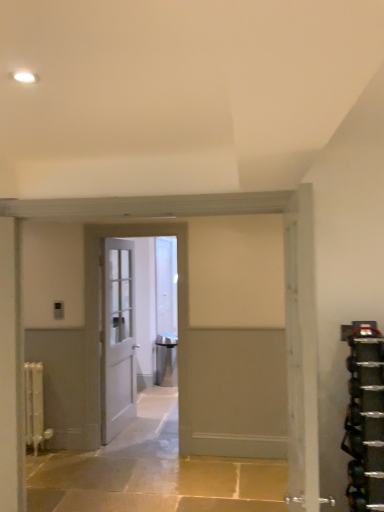
Question: From the image's perspective, would you say white matte radiator at left is shown under white painted wood door at center, acting as the 4th door starting from the left?

Choices:
 (A) no
 (B) yes

Answer: (B)

Question: Can you confirm if white matte radiator at left is wider than white painted wood door at center, acting as the fourth door starting from the back?

Choices:
 (A) no
 (B) yes

Answer: (A)

Question: Can you confirm if white matte radiator at left is positioned to the left of white painted wood door at center, acting as the fourth door starting from the back?

Choices:
 (A) no
 (B) yes

Answer: (B)

Question: Is the surface of white matte radiator at left in direct contact with white painted wood door at center, acting as the 4th door starting from the left?

Choices:
 (A) yes
 (B) no

Answer: (B)

Question: Is white painted wood door at center, which is the first door from right to left, located within white matte radiator at left?

Choices:
 (A) yes
 (B) no

Answer: (B)

Question: In the image, is white matte radiator at left on the left side or the right side of white painted wood door at center, acting as the 4th door starting from the left?

Choices:
 (A) right
 (B) left

Answer: (B)

Question: Considering the positions of white matte radiator at left and white painted wood door at center, acting as the 4th door starting from the left, in the image, is white matte radiator at left bigger or smaller than white painted wood door at center, acting as the 4th door starting from the left,?

Choices:
 (A) small
 (B) big

Answer: (A)

Question: From the image's perspective, relative to white painted wood door at center, acting as the fourth door starting from the back, is white matte radiator at left above or below?

Choices:
 (A) below
 (B) above

Answer: (A)

Question: Looking at their shapes, would you say white matte radiator at left is wider or thinner than white painted wood door at center, the first door viewed from the front?

Choices:
 (A) wide
 (B) thin

Answer: (B)

Question: In the image, is white wooden door at center, acting as the 3th door starting from the front, on the left side or the right side of white wooden door at center, acting as the second door starting from the left?

Choices:
 (A) right
 (B) left

Answer: (B)

Question: From the image's perspective, is white wooden door at center, the 2th door when ordered from back to front, positioned above or below white wooden door at center, which appears as the second door when viewed from the front?

Choices:
 (A) below
 (B) above

Answer: (A)

Question: Is white wooden door at center, acting as the 3th door starting from the front, inside or outside of white wooden door at center, which ranks as the third door in right-to-left order?

Choices:
 (A) outside
 (B) inside

Answer: (A)

Question: In terms of height, does white wooden door at center, which ranks as the fourth door in right-to-left order, look taller or shorter compared to white wooden door at center, the third door when ordered from back to front?

Choices:
 (A) tall
 (B) short

Answer: (B)

Question: Does point (316, 458) appear closer or farther from the camera than point (160, 267)?

Choices:
 (A) farther
 (B) closer

Answer: (B)

Question: In terms of size, does white painted wood door at center, acting as the 4th door starting from the left, appear bigger or smaller than white glossy door at center, the 4th door viewed from the front?

Choices:
 (A) big
 (B) small

Answer: (A)